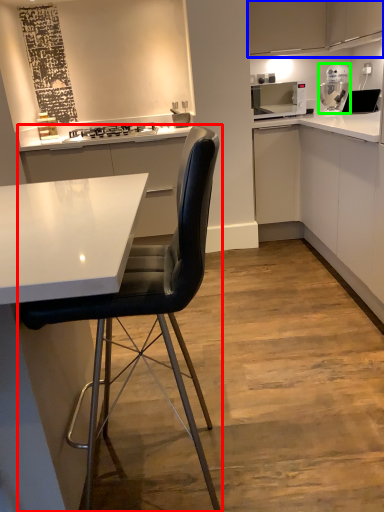
Question: Which object is the farthest from chair (highlighted by a red box)? Choose among these: cabinetry (highlighted by a blue box) or kitchen appliance (highlighted by a green box).

Choices:
 (A) cabinetry
 (B) kitchen appliance

Answer: (B)